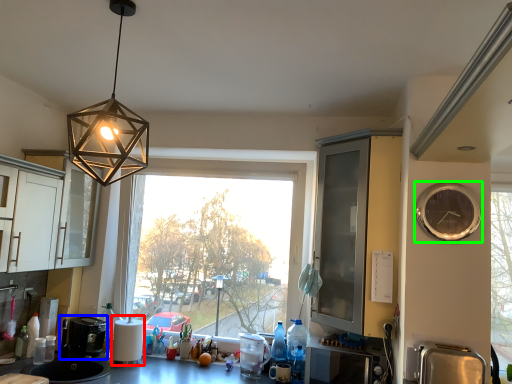
Question: Which object is the closest to the appliance (highlighted by a red box)? Choose among these: coffee machine (highlighted by a blue box) or clock (highlighted by a green box).

Choices:
 (A) coffee machine
 (B) clock

Answer: (A)